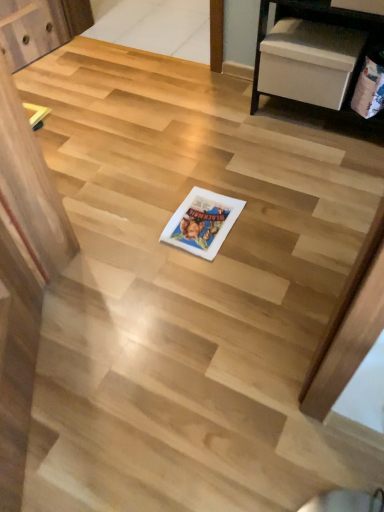
At what (x,y) coordinates should I click in order to perform the action: click on vacant region above white paper comic book at center, which is counted as the 1th comic book, starting from the left (from a real-world perspective). Please return your answer as a coordinate pair (x, y). Looking at the image, I should click on (200, 221).